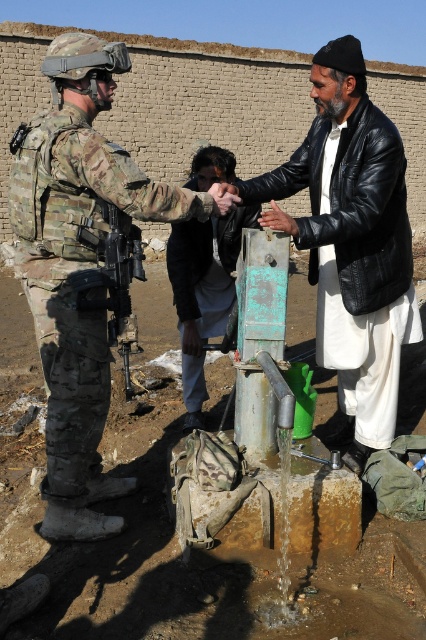
Can you confirm if camouflage fabric uniform at left is positioned below black leather jacket at right?

Yes.

Does camouflage fabric uniform at left appear over black leather jacket at right?

No, camouflage fabric uniform at left is not above black leather jacket at right.

Which is in front, point (115, 200) or point (342, 58)?

Point (115, 200) is in front.

Locate an element on the screen. This screenshot has width=426, height=640. camouflage fabric uniform at left is located at coordinates (80, 266).

Does point (385, 356) come in front of point (201, 426)?

That is True.

Can you confirm if black leather jacket at right is positioned below dark brown leather jacket at center?

Actually, black leather jacket at right is above dark brown leather jacket at center.

Between point (350, 230) and point (190, 365), which one is positioned in front?

Positioned in front is point (350, 230).

The height and width of the screenshot is (640, 426). What are the coordinates of `black leather jacket at right` in the screenshot? It's located at (351, 243).

Which is more to the left, dark brown leather jacket at center or camouflage fabric rifle at center?

camouflage fabric rifle at center is more to the left.

Which is above, dark brown leather jacket at center or camouflage fabric rifle at center?

dark brown leather jacket at center is higher up.

Locate an element on the screen. dark brown leather jacket at center is located at coordinates (204, 291).

Where is `dark brown leather jacket at center`? dark brown leather jacket at center is located at coordinates (204, 291).